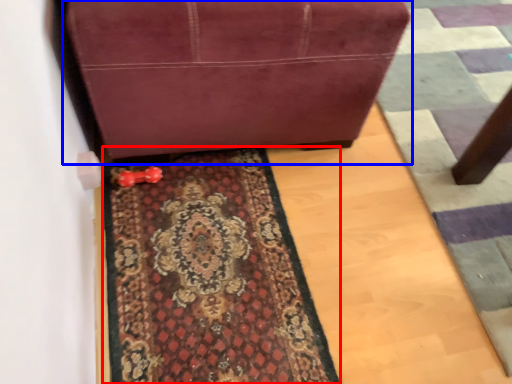
Question: Which object appears closest to the camera in this image, mat (highlighted by a red box) or furniture (highlighted by a blue box)?

Choices:
 (A) mat
 (B) furniture

Answer: (B)